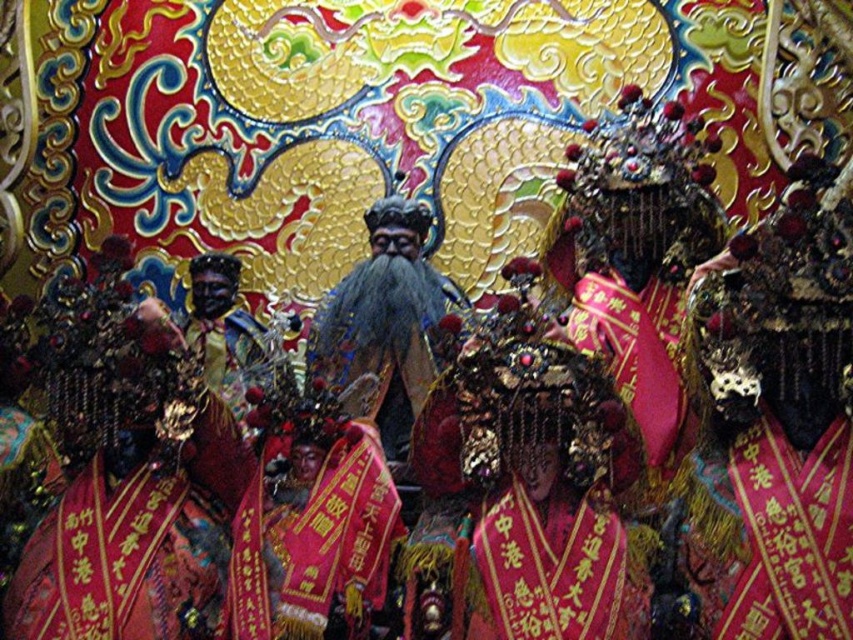
Question: Is velvet red banner at center wider than shiny gold statue at center?

Choices:
 (A) no
 (B) yes

Answer: (A)

Question: Among these points, which one is farthest from the camera?

Choices:
 (A) pyautogui.click(x=387, y=212)
 (B) pyautogui.click(x=598, y=541)

Answer: (A)

Question: Where is velvet red banner at center located in relation to shiny gold statue at center in the image?

Choices:
 (A) right
 (B) left

Answer: (A)

Question: Is velvet red banner at center bigger than shiny gold statue at center?

Choices:
 (A) no
 (B) yes

Answer: (A)